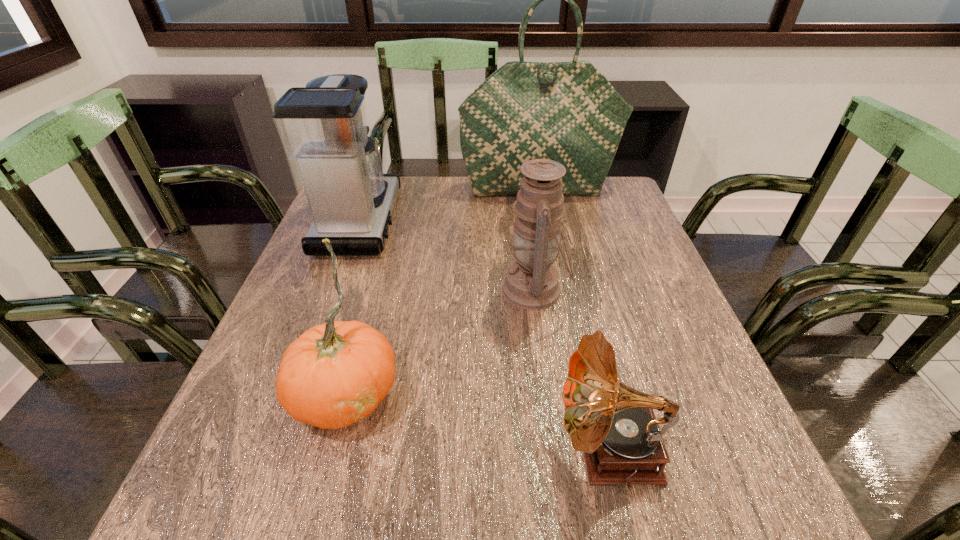
The height and width of the screenshot is (540, 960). I want to click on object that is at the far right corner, so click(568, 112).

Image resolution: width=960 pixels, height=540 pixels. I want to click on object present at the near right corner, so click(x=614, y=424).

In the image, there is a desktop. At what (x,y) coordinates should I click in order to perform the action: click on vacant space at the far edge. Please return your answer as a coordinate pair (x, y). Looking at the image, I should click on 457,203.

Where is `free location at the near edge`? This screenshot has width=960, height=540. free location at the near edge is located at coordinates (637, 507).

The height and width of the screenshot is (540, 960). Find the location of `free spot at the left edge of the desktop`. free spot at the left edge of the desktop is located at coordinates (280, 338).

In the image, there is a desktop. What are the coordinates of `vacant space at the right edge` in the screenshot? It's located at (642, 281).

Find the location of `vacant area at the near left corner of the desktop`. vacant area at the near left corner of the desktop is located at coordinates (230, 506).

Locate an element on the screen. vacant space that is in between the coffee maker and the oil lamp is located at coordinates (447, 255).

This screenshot has height=540, width=960. What are the coordinates of `vacant point located between the phonograph_record and the second tallest object` in the screenshot? It's located at (485, 336).

Locate an element on the screen. free spot between the coffee maker and the phonograph_record is located at coordinates (485, 336).